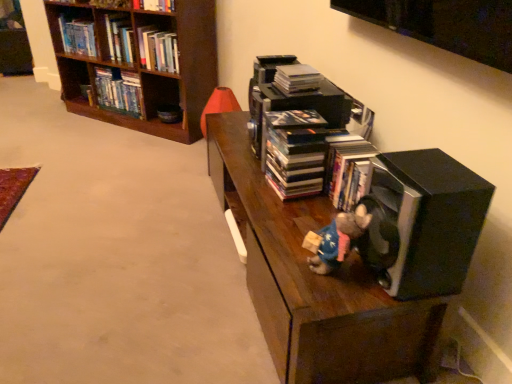
Find the location of `free space in front of brown wooden bookcase at upper left`. free space in front of brown wooden bookcase at upper left is located at coordinates (83, 162).